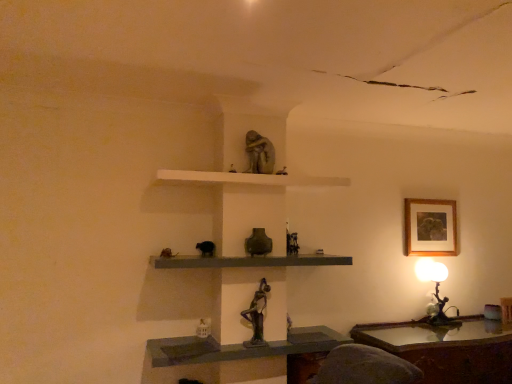
What do you see at coordinates (259, 153) in the screenshot?
I see `matte gray stone statue at upper center, positioned as the 1th sculpture in top-to-bottom order` at bounding box center [259, 153].

This screenshot has height=384, width=512. In order to click on metallic bronze figurine at right in this screenshot , I will do `click(435, 291)`.

The width and height of the screenshot is (512, 384). I want to click on wooden polished table at lower right, so click(x=447, y=349).

Is white matte shelf at upper center, the 3th shelf when ordered from bottom to top, positioned with its back to wooden polished table at lower right?

No, white matte shelf at upper center, the 3th shelf when ordered from bottom to top, is not facing away from wooden polished table at lower right.

Is white matte shelf at upper center, which is the first shelf in top-to-bottom order, at the right side of wooden polished table at lower right?

In fact, white matte shelf at upper center, which is the first shelf in top-to-bottom order, is to the left of wooden polished table at lower right.

Considering the relative positions of white matte shelf at upper center, which is the first shelf in top-to-bottom order, and wooden polished table at lower right in the image provided, is white matte shelf at upper center, which is the first shelf in top-to-bottom order, behind wooden polished table at lower right?

No, it is in front of wooden polished table at lower right.

From a real-world perspective, which object stands above the other?

In real-world perspective, white matte shelf at upper center, which is the first shelf in top-to-bottom order, is above.

From a real-world perspective, which is physically above, wooden framed artwork at upper right or matte gray stone statue at upper center, placed as the 2th sculpture when sorted from bottom to top?

In real-world perspective, matte gray stone statue at upper center, placed as the 2th sculpture when sorted from bottom to top, is above.

Between point (445, 224) and point (245, 139), which one is positioned in front?

Positioned in front is point (245, 139).

Which object is further away from the camera, wooden framed artwork at upper right or matte gray stone statue at upper center, positioned as the 1th sculpture in top-to-bottom order?

wooden framed artwork at upper right is further away from the camera.

From the image's perspective, who appears lower, wooden framed artwork at upper right or matte gray stone statue at upper center, placed as the 2th sculpture when sorted from bottom to top?

From the image's view, wooden framed artwork at upper right is below.

What's the angular difference between bronze statue at center, the 2th sculpture in the top-to-bottom sequence, and wooden polished table at lower right's facing directions?

There is a 0.886-degree angle between the facing directions of bronze statue at center, the 2th sculpture in the top-to-bottom sequence, and wooden polished table at lower right.

Is bronze statue at center, the first sculpture from the bottom, taller or shorter than wooden polished table at lower right?

In the image, bronze statue at center, the first sculpture from the bottom, appears to be shorter than wooden polished table at lower right.

Are bronze statue at center, the first sculpture from the bottom, and wooden polished table at lower right beside each other?

bronze statue at center, the first sculpture from the bottom, is not next to wooden polished table at lower right, and they're not touching.

I want to click on the 1st sculpture positioned above the wooden polished table at lower right (from the image's perspective), so tap(257, 315).

From a real-world perspective, who is located lower, bronze statue at center, positioned as the 1th shelf in bottom-to-top order, or metallic bronze figurine at right?

bronze statue at center, positioned as the 1th shelf in bottom-to-top order, is physically lower.

Which object is thinner, bronze statue at center, which is counted as the third shelf, starting from the top, or metallic bronze figurine at right?

With smaller width is metallic bronze figurine at right.

Can you confirm if bronze statue at center, positioned as the 1th shelf in bottom-to-top order, is taller than metallic bronze figurine at right?

Incorrect, the height of bronze statue at center, positioned as the 1th shelf in bottom-to-top order, is not larger of that of metallic bronze figurine at right.

Considering the points (183, 345) and (439, 275), which point is in front, point (183, 345) or point (439, 275)?

Positioned in front is point (183, 345).

Is metallic bronze figurine at right next to wooden polished table at lower right and touching it?

No, metallic bronze figurine at right is not with wooden polished table at lower right.

Could you tell me if metallic bronze figurine at right is facing wooden polished table at lower right?

No, metallic bronze figurine at right is not facing towards wooden polished table at lower right.

Visually, is metallic bronze figurine at right positioned to the left or to the right of wooden polished table at lower right?

Based on their positions, metallic bronze figurine at right is located to the right of wooden polished table at lower right.

Considering the relative sizes of wooden framed artwork at upper right and white matte shelf at upper center, which is the first shelf in top-to-bottom order, in the image provided, is wooden framed artwork at upper right smaller than white matte shelf at upper center, which is the first shelf in top-to-bottom order,?

Correct, wooden framed artwork at upper right occupies less space than white matte shelf at upper center, which is the first shelf in top-to-bottom order.

Is wooden framed artwork at upper right aimed at white matte shelf at upper center, which is the first shelf in top-to-bottom order?

No, wooden framed artwork at upper right is not turned towards white matte shelf at upper center, which is the first shelf in top-to-bottom order.

Can you confirm if wooden framed artwork at upper right is wider than white matte shelf at upper center, the 3th shelf when ordered from bottom to top?

No.

Who is taller, matte gray stone statue at upper center, positioned as the 1th sculpture in top-to-bottom order, or white matte shelf at upper center, the 3th shelf when ordered from bottom to top?

matte gray stone statue at upper center, positioned as the 1th sculpture in top-to-bottom order, is taller.

Is matte gray stone statue at upper center, placed as the 2th sculpture when sorted from bottom to top, beside white matte shelf at upper center, which is the first shelf in top-to-bottom order?

No, matte gray stone statue at upper center, placed as the 2th sculpture when sorted from bottom to top, is not making contact with white matte shelf at upper center, which is the first shelf in top-to-bottom order.

What are the coordinates of `the 1st shelf below when counting from the matte gray stone statue at upper center, placed as the 2th sculpture when sorted from bottom to top (from the image's perspective)` in the screenshot? It's located at (248, 178).

This screenshot has width=512, height=384. What are the coordinates of `the 1st shelf in front of the wooden polished table at lower right` in the screenshot? It's located at (248, 178).

The height and width of the screenshot is (384, 512). I want to click on sculpture above the wooden framed artwork at upper right (from a real-world perspective), so click(x=259, y=153).

In the scene shown: Looking at the image, which one is located closer to wooden polished table at lower right, matte gray shelf at center, acting as the second shelf starting from the top, or matte gray stone statue at upper center, placed as the 2th sculpture when sorted from bottom to top?

matte gray shelf at center, acting as the second shelf starting from the top, is positioned closer to the anchor wooden polished table at lower right.

Consider the image. Considering their positions, is bronze statue at center, the first sculpture from the bottom, positioned closer to matte gray stone statue at upper center, positioned as the 1th sculpture in top-to-bottom order, than matte gray shelf at center, which ranks as the 2th shelf in bottom-to-top order?

Based on the image, matte gray shelf at center, which ranks as the 2th shelf in bottom-to-top order, appears to be nearer to matte gray stone statue at upper center, positioned as the 1th sculpture in top-to-bottom order.

Considering their positions, is wooden polished table at lower right positioned closer to matte gray shelf at center, which ranks as the 2th shelf in bottom-to-top order, than bronze statue at center, the first sculpture from the bottom?

bronze statue at center, the first sculpture from the bottom, is positioned closer to the anchor matte gray shelf at center, which ranks as the 2th shelf in bottom-to-top order.

Which object lies further to the anchor point bronze statue at center, the 2th sculpture in the top-to-bottom sequence, matte gray shelf at center, acting as the second shelf starting from the top, or matte gray stone statue at upper center, positioned as the 1th sculpture in top-to-bottom order?

matte gray stone statue at upper center, positioned as the 1th sculpture in top-to-bottom order, is positioned further to the anchor bronze statue at center, the 2th sculpture in the top-to-bottom sequence.

Looking at this image, considering their positions, is matte gray shelf at center, acting as the second shelf starting from the top, positioned closer to white matte shelf at upper center, the 3th shelf when ordered from bottom to top, than matte gray stone statue at upper center, placed as the 2th sculpture when sorted from bottom to top?

The object closer to white matte shelf at upper center, the 3th shelf when ordered from bottom to top, is matte gray stone statue at upper center, placed as the 2th sculpture when sorted from bottom to top.

Estimate the real-world distances between objects in this image. Which object is closer to wooden polished table at lower right, bronze statue at center, positioned as the 1th shelf in bottom-to-top order, or matte gray shelf at center, acting as the second shelf starting from the top?

Based on the image, bronze statue at center, positioned as the 1th shelf in bottom-to-top order, appears to be nearer to wooden polished table at lower right.

When comparing their distances from wooden polished table at lower right, does bronze statue at center, which is counted as the third shelf, starting from the top, or matte gray stone statue at upper center, positioned as the 1th sculpture in top-to-bottom order, seem further?

Based on the image, matte gray stone statue at upper center, positioned as the 1th sculpture in top-to-bottom order, appears to be further to wooden polished table at lower right.

Estimate the real-world distances between objects in this image. Which object is closer to bronze statue at center, the first sculpture from the bottom, wooden framed artwork at upper right or bronze statue at center, positioned as the 1th shelf in bottom-to-top order?

bronze statue at center, positioned as the 1th shelf in bottom-to-top order, is positioned closer to the anchor bronze statue at center, the first sculpture from the bottom.

The image size is (512, 384). Identify the location of table situated between bronze statue at center, positioned as the 1th shelf in bottom-to-top order, and metallic bronze figurine at right from left to right. (447, 349).

Locate an element on the screen. This screenshot has width=512, height=384. table between matte gray shelf at center, which ranks as the 2th shelf in bottom-to-top order, and metallic bronze figurine at right, in the horizontal direction is located at coordinates (447, 349).

At what (x,y) coordinates should I click in order to perform the action: click on table lamp between wooden framed artwork at upper right and wooden polished table at lower right in the up-down direction. Please return your answer as a coordinate pair (x, y). The width and height of the screenshot is (512, 384). Looking at the image, I should click on (435, 291).

This screenshot has width=512, height=384. Find the location of `sculpture between bronze statue at center, the first sculpture from the bottom, and metallic bronze figurine at right, in the horizontal direction`. sculpture between bronze statue at center, the first sculpture from the bottom, and metallic bronze figurine at right, in the horizontal direction is located at coordinates (259, 153).